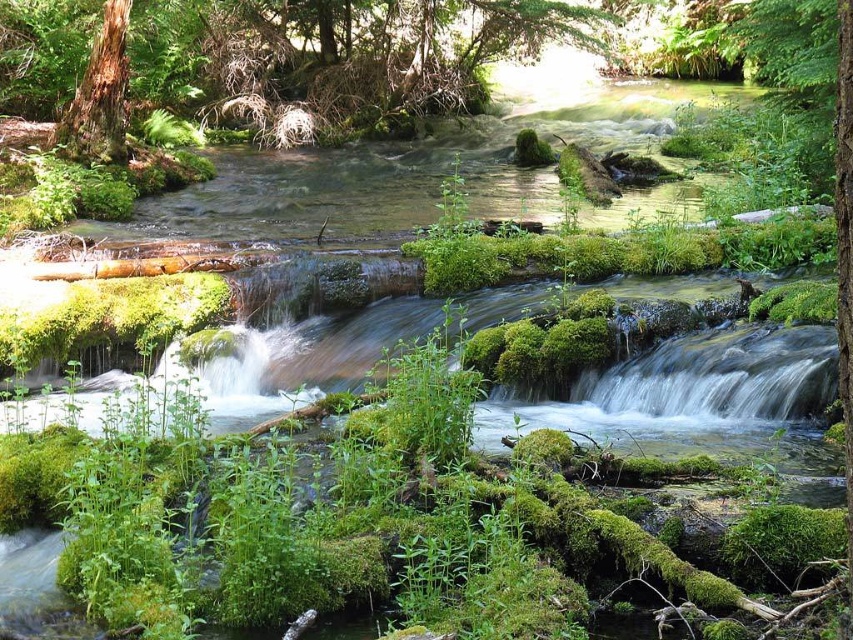
In the scene shown: You are a hiker who wants to cross the stream using the fallen logs. You notice two tree trunks at the upper left corner of the scene. Which tree trunk is closer to the stream? The smooth brown tree trunk at upper left or the brown textured tree trunk at upper left?

The smooth brown tree trunk at upper left is positioned over brown textured tree trunk at upper left, so the smooth brown tree trunk at upper left is closer to the stream than the brown textured tree trunk at upper left.

You are a hiker who wants to climb the tallest tree trunk in the area. Which one should you choose between the smooth brown tree trunk at upper left and the brown textured tree trunk at upper left?

The smooth brown tree trunk at upper left is taller than the brown textured tree trunk at upper left, so you should choose the smooth brown tree trunk at upper left.

You are a hiker trying to cross the stream using the fallen logs. You notice two tree trunks on the bank at the upper left. The first is smooth brown tree trunk at upper left, and the second is brown textured tree trunk at upper left. Which tree trunk is wider?

The smooth brown tree trunk at upper left is wider than the brown textured tree trunk at upper left.